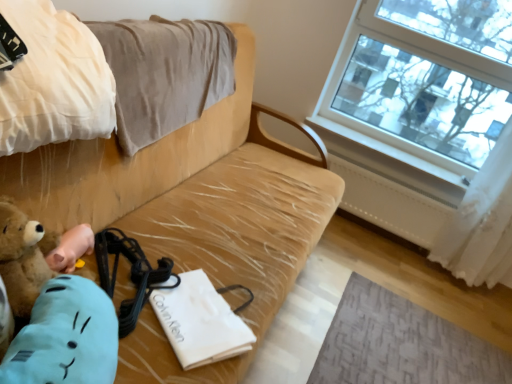
Question: Considering the relative sizes of beige fabric couch at center and beige cotton blanket at upper left, placed as the first blanket when sorted from front to back, in the image provided, is beige fabric couch at center shorter than beige cotton blanket at upper left, placed as the first blanket when sorted from front to back,?

Choices:
 (A) no
 (B) yes

Answer: (A)

Question: Is beige fabric couch at center to the right of beige cotton blanket at upper left, placed as the first blanket when sorted from front to back, from the viewer's perspective?

Choices:
 (A) no
 (B) yes

Answer: (B)

Question: From the image's perspective, is beige fabric couch at center located above beige cotton blanket at upper left, the second blanket when ordered from back to front?

Choices:
 (A) no
 (B) yes

Answer: (A)

Question: Would you say beige fabric couch at center is outside beige cotton blanket at upper left, placed as the first blanket when sorted from front to back?

Choices:
 (A) yes
 (B) no

Answer: (A)

Question: From a real-world perspective, is beige fabric couch at center located beneath beige cotton blanket at upper left, the second blanket when ordered from back to front?

Choices:
 (A) yes
 (B) no

Answer: (A)

Question: Does beige fabric couch at center come in front of beige cotton blanket at upper left, the second blanket when ordered from back to front?

Choices:
 (A) yes
 (B) no

Answer: (A)

Question: From a real-world perspective, is beige cotton blanket at upper left, the 2th blanket when ordered from front to back, on brown plush toy at lower left?

Choices:
 (A) yes
 (B) no

Answer: (A)

Question: Is beige cotton blanket at upper left, the 2th blanket when ordered from front to back, bigger than brown plush toy at lower left?

Choices:
 (A) no
 (B) yes

Answer: (B)

Question: Is beige cotton blanket at upper left, the 2th blanket when ordered from front to back, with brown plush toy at lower left?

Choices:
 (A) yes
 (B) no

Answer: (B)

Question: Does beige cotton blanket at upper left, the first blanket in the back-to-front sequence, have a greater width compared to brown plush toy at lower left?

Choices:
 (A) no
 (B) yes

Answer: (B)

Question: From a real-world perspective, is beige cotton blanket at upper left, the 2th blanket when ordered from front to back, under brown plush toy at lower left?

Choices:
 (A) no
 (B) yes

Answer: (A)

Question: Is beige cotton blanket at upper left, the first blanket in the back-to-front sequence, shorter than brown plush toy at lower left?

Choices:
 (A) yes
 (B) no

Answer: (B)

Question: Is beige cotton blanket at upper left, placed as the first blanket when sorted from front to back, directly adjacent to beige cotton blanket at upper left, the 2th blanket when ordered from front to back?

Choices:
 (A) yes
 (B) no

Answer: (B)